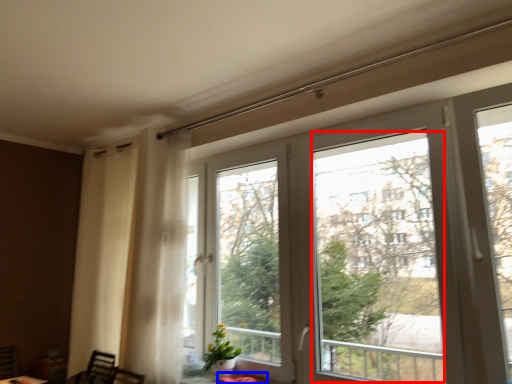
Question: Which of the following is the closest to the observer, window screen (highlighted by a red box) or table (highlighted by a blue box)?

Choices:
 (A) window screen
 (B) table

Answer: (A)